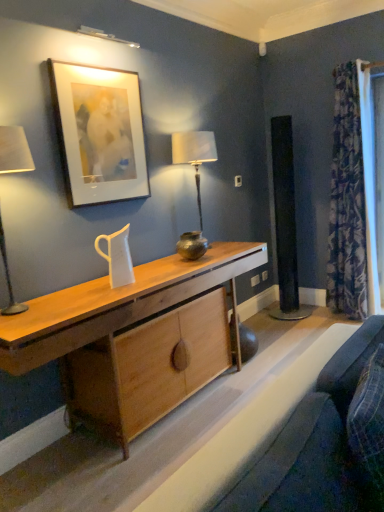
This screenshot has width=384, height=512. I want to click on free spot below shiny metallic vase at center (from a real-world perspective), so click(191, 261).